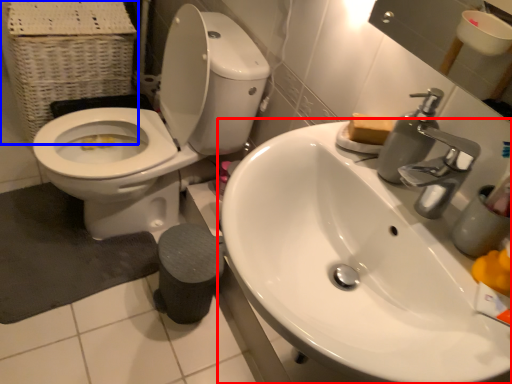
Question: Which object appears farthest to the camera in this image, sink (highlighted by a red box) or basket (highlighted by a blue box)?

Choices:
 (A) sink
 (B) basket

Answer: (B)